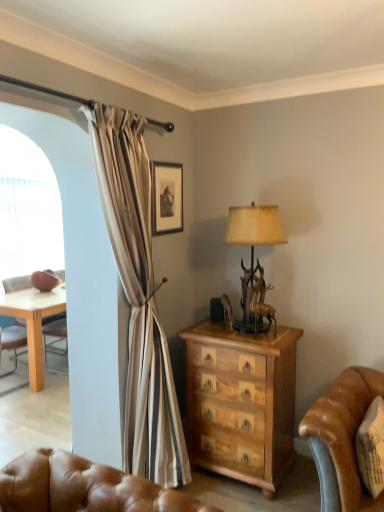
Question: From the image's perspective, is transparent plastic screen at left beneath antique brass lamp at center?

Choices:
 (A) no
 (B) yes

Answer: (A)

Question: Can you confirm if transparent plastic screen at left is positioned to the left of antique brass lamp at center?

Choices:
 (A) no
 (B) yes

Answer: (B)

Question: Is transparent plastic screen at left turned away from antique brass lamp at center?

Choices:
 (A) yes
 (B) no

Answer: (B)

Question: Is transparent plastic screen at left not inside antique brass lamp at center?

Choices:
 (A) yes
 (B) no

Answer: (A)

Question: Does transparent plastic screen at left appear on the right side of antique brass lamp at center?

Choices:
 (A) yes
 (B) no

Answer: (B)

Question: From the image's perspective, is matte black picture frame at upper center located above or below wooden chest of drawers at center?

Choices:
 (A) above
 (B) below

Answer: (A)

Question: From a real-world perspective, is matte black picture frame at upper center above or below wooden chest of drawers at center?

Choices:
 (A) above
 (B) below

Answer: (A)

Question: Is matte black picture frame at upper center wider or thinner than wooden chest of drawers at center?

Choices:
 (A) thin
 (B) wide

Answer: (A)

Question: Based on their sizes in the image, would you say matte black picture frame at upper center is bigger or smaller than wooden chest of drawers at center?

Choices:
 (A) small
 (B) big

Answer: (A)

Question: In terms of width, does wooden chest of drawers at center look wider or thinner when compared to matte black picture frame at upper center?

Choices:
 (A) wide
 (B) thin

Answer: (A)

Question: From a real-world perspective, is wooden chest of drawers at center above or below matte black picture frame at upper center?

Choices:
 (A) below
 (B) above

Answer: (A)

Question: Considering their positions, is wooden chest of drawers at center located in front of or behind matte black picture frame at upper center?

Choices:
 (A) behind
 (B) front

Answer: (B)

Question: Is wooden chest of drawers at center bigger or smaller than matte black picture frame at upper center?

Choices:
 (A) big
 (B) small

Answer: (A)

Question: Based on their sizes in the image, would you say transparent plastic screen at left is bigger or smaller than matte black picture frame at upper center?

Choices:
 (A) big
 (B) small

Answer: (A)

Question: Is transparent plastic screen at left spatially inside matte black picture frame at upper center, or outside of it?

Choices:
 (A) outside
 (B) inside

Answer: (A)